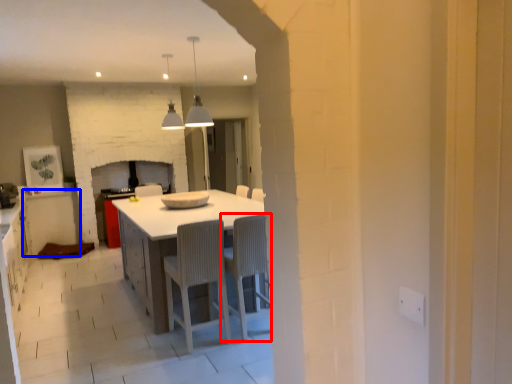
Question: Which point is closer to the camera, chair (highlighted by a red box) or cabinetry (highlighted by a blue box)?

Choices:
 (A) chair
 (B) cabinetry

Answer: (A)